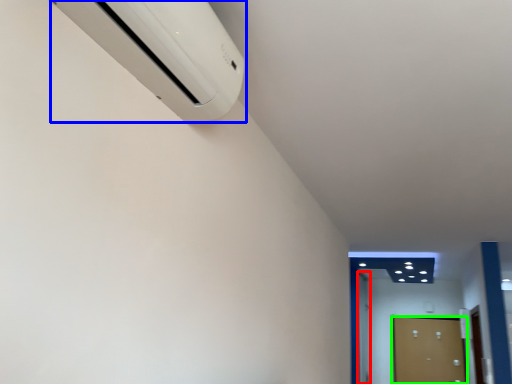
Question: Which object is positioned farthest from door (highlighted by a red box)? Select from home appliance (highlighted by a blue box) and door (highlighted by a green box).

Choices:
 (A) home appliance
 (B) door

Answer: (A)